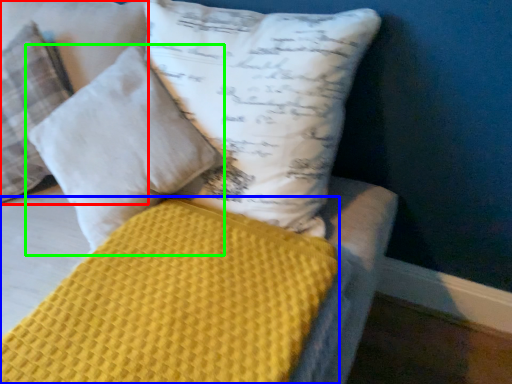
Question: Estimate the real-world distances between objects in this image. Which object is farther from pillow (highlighted by a red box), mattress (highlighted by a blue box) or pillow (highlighted by a green box)?

Choices:
 (A) mattress
 (B) pillow

Answer: (A)